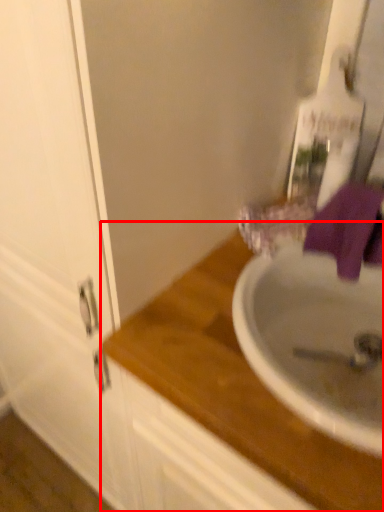
Question: From the image's perspective, what is the correct spatial positioning of countertop (annotated by the red box) in reference to bath towel?

Choices:
 (A) below
 (B) above

Answer: (A)